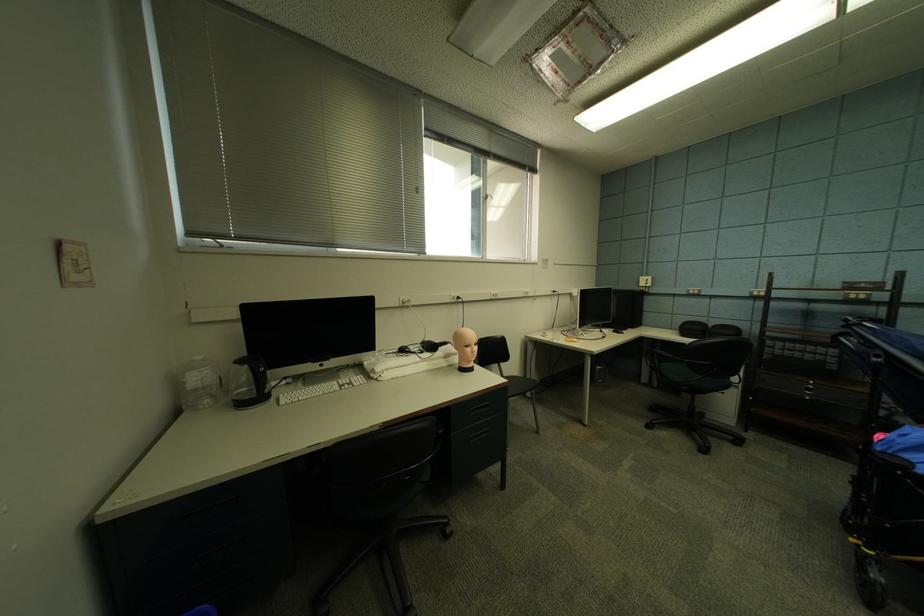
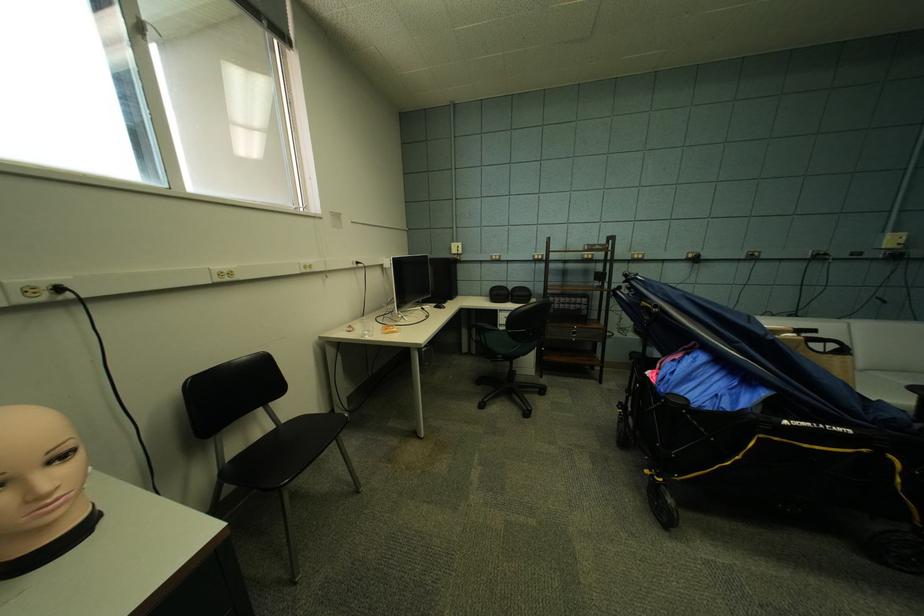
Question: The first image is from the beginning of the video and the second image is from the end. How did the camera likely rotate when shooting the video?

Choices:
 (A) Left
 (B) Right
 (C) Up
 (D) Down

Answer: (B)